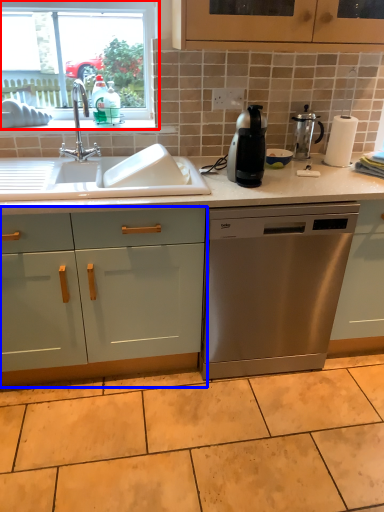
Question: Among these objects, which one is nearest to the camera, window (highlighted by a red box) or cabinetry (highlighted by a blue box)?

Choices:
 (A) window
 (B) cabinetry

Answer: (B)